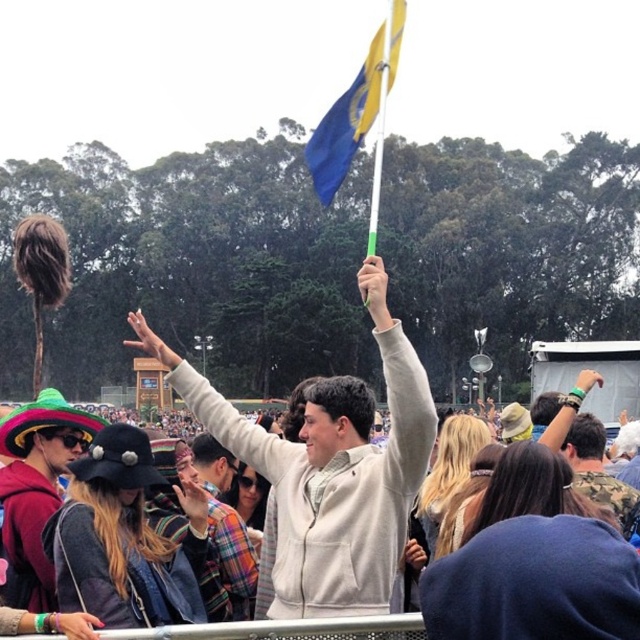
Question: Is light gray fleece jacket at center to the left of camouflage fabric shirt at upper right from the viewer's perspective?

Choices:
 (A) no
 (B) yes

Answer: (B)

Question: Among these points, which one is farthest from the camera?

Choices:
 (A) (548, 422)
 (B) (344, 148)

Answer: (A)

Question: Which point is farther from the camera taking this photo?

Choices:
 (A) (285, 500)
 (B) (362, 140)

Answer: (B)

Question: Which point is farther to the camera?

Choices:
 (A) light gray fleece jacket at center
 (B) blue fabric flag at upper center
 (C) camouflage fabric shirt at upper right

Answer: (B)

Question: Is blue fabric flag at upper center to the left of camouflage fabric shirt at upper right from the viewer's perspective?

Choices:
 (A) no
 (B) yes

Answer: (B)

Question: Is light gray fleece jacket at center further to camera compared to camouflage fabric shirt at upper right?

Choices:
 (A) no
 (B) yes

Answer: (A)